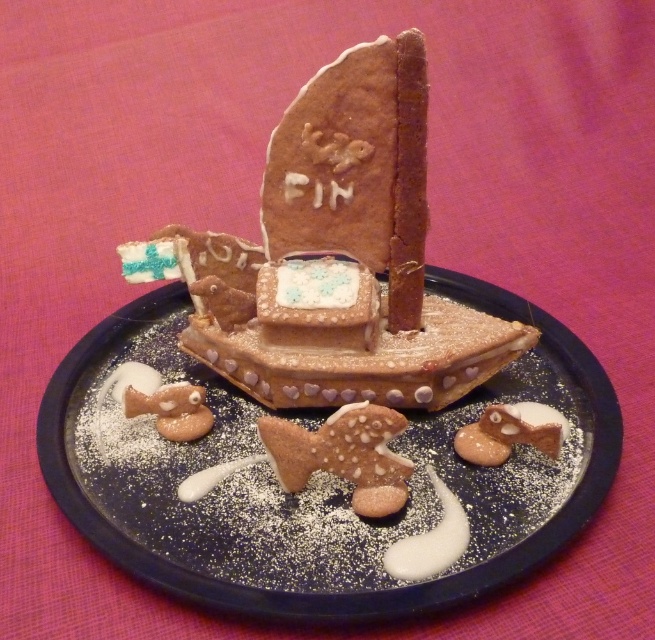
Question: Does dark blue plate at center appear under chocolate cookie boat at center?

Choices:
 (A) yes
 (B) no

Answer: (A)

Question: Which object is positioned farthest from the chocolate cookie boat at center?

Choices:
 (A) glazed brown fish at center
 (B) dark blue plate at center

Answer: (A)

Question: Can you confirm if chocolate cookie boat at center is bigger than glazed brown fish at center?

Choices:
 (A) yes
 (B) no

Answer: (A)

Question: Which object is farther from the camera taking this photo?

Choices:
 (A) chocolate cookie boat at center
 (B) dark blue plate at center

Answer: (A)

Question: Which point is farther from the camera taking this photo?

Choices:
 (A) (393, 605)
 (B) (398, 250)

Answer: (B)

Question: Is dark blue plate at center to the left of chocolate cookie boat at center from the viewer's perspective?

Choices:
 (A) yes
 (B) no

Answer: (A)